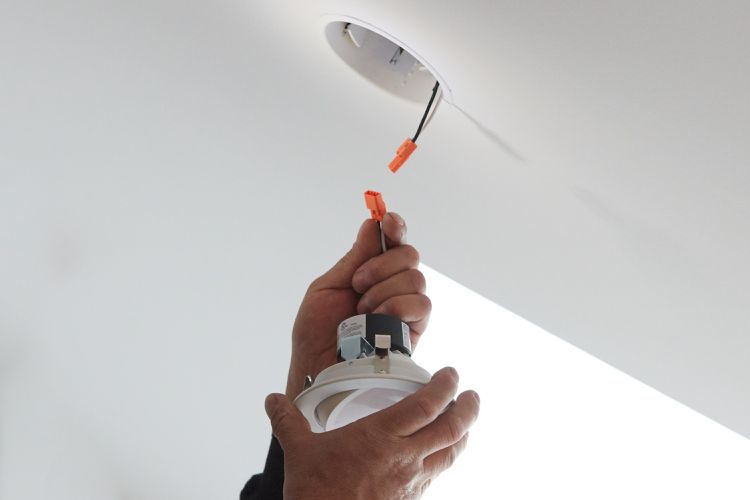
The height and width of the screenshot is (500, 750). I want to click on orange plug, so click(397, 155).